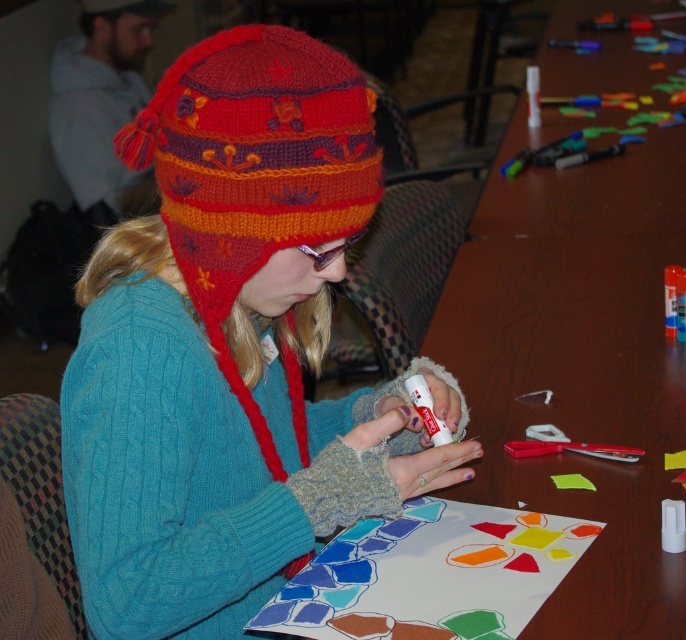
Is the position of knitted woolen hat at center more distant than that of wooden table at center?

No, knitted woolen hat at center is closer to the viewer.

Who is positioned more to the right, knitted woolen hat at center or wooden table at center?

Positioned to the right is wooden table at center.

You are a GUI agent. You are given a task and a screenshot of the screen. Output one action in this format:
    pyautogui.click(x=<x>, y=<y>)
    Task: Click on the knitted woolen hat at center
    
    Given the screenshot: What is the action you would take?
    [228, 348]